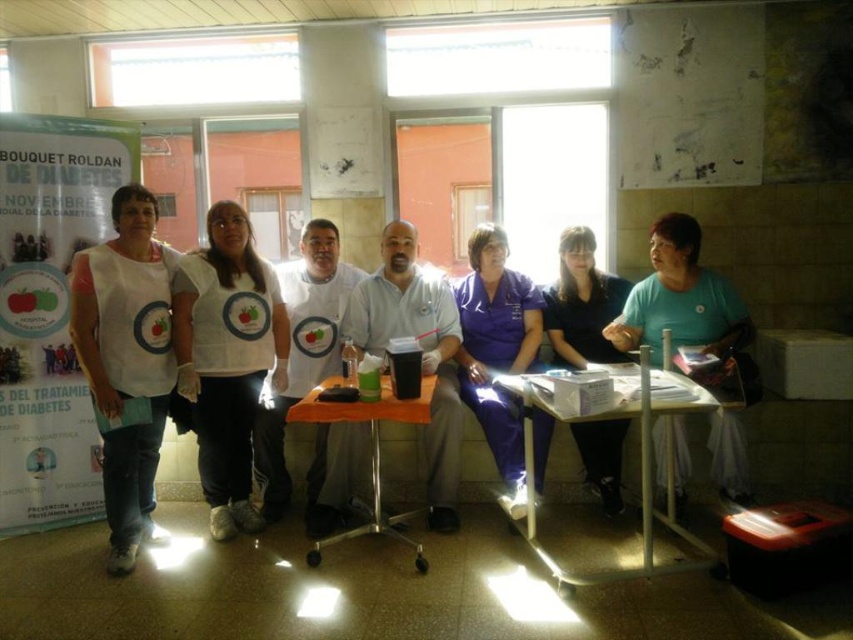
You are standing in the clinic and need to locate the black fabric shirt at center. According to the scene description, where would you find it?

The black fabric shirt at center is located at the center of the scene, positioned at the coordinates 0.475 on the x axis and 0.682 on the y axis.

You are a photographer setting up for a group photo in the clinic. You notice the black fabric shirt at center and the matte plastic table at center. Which object is narrower in width?

The black fabric shirt at center is thinner than the matte plastic table at center, so the black fabric shirt at center is narrower in width.